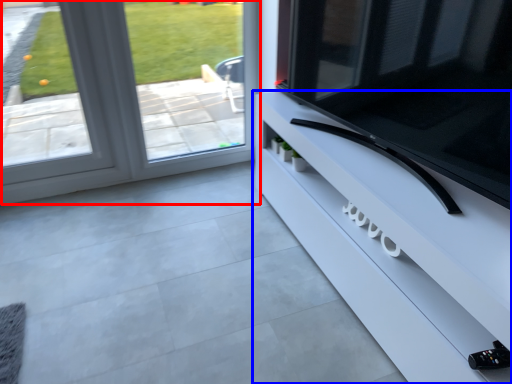
Question: Which object is closer to the camera taking this photo, window (highlighted by a red box) or furniture (highlighted by a blue box)?

Choices:
 (A) window
 (B) furniture

Answer: (B)